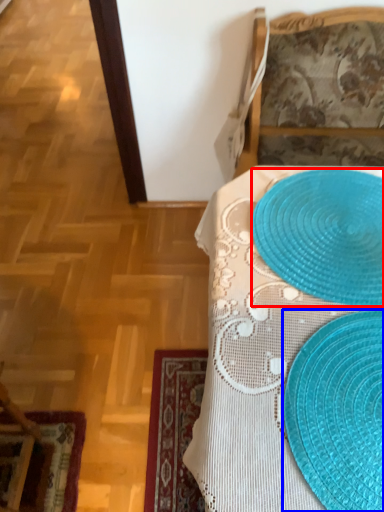
Question: Which point is closer to the camera, platter (highlighted by a red box) or straw hat (highlighted by a blue box)?

Choices:
 (A) platter
 (B) straw hat

Answer: (B)